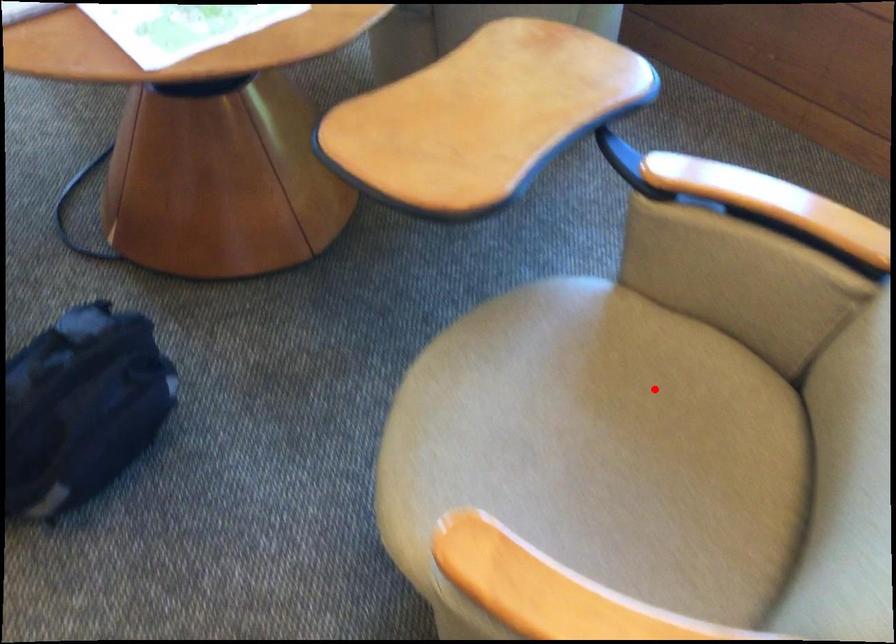
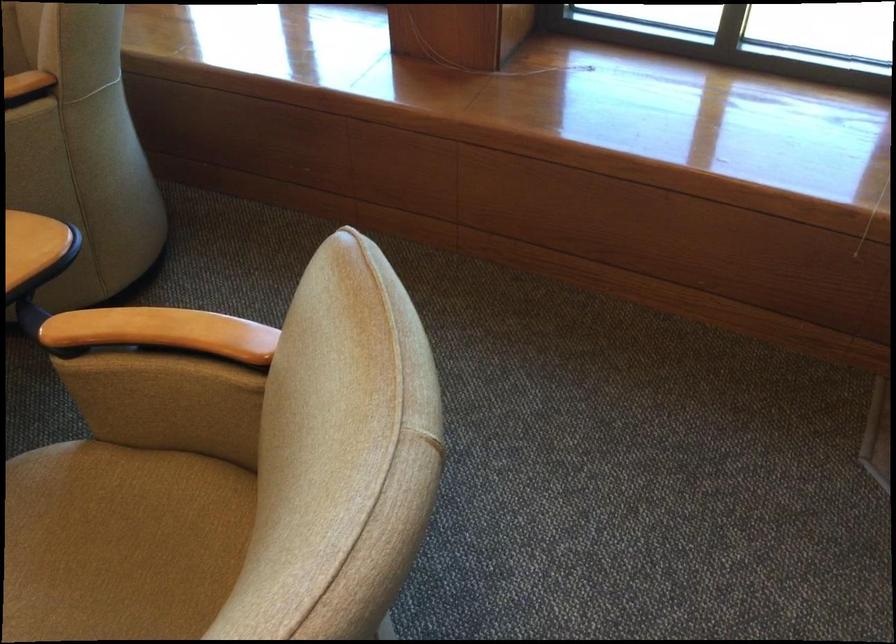
Find the pixel in the second image that matches the highlighted location in the first image.

(121, 542)